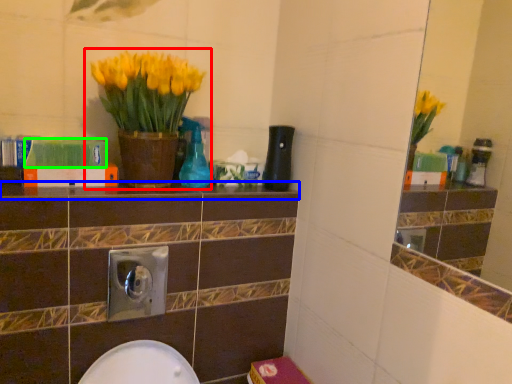
Question: Which object is positioned closest to houseplant (highlighted by a red box)? Select from ledge (highlighted by a blue box) and book (highlighted by a green box).

Choices:
 (A) ledge
 (B) book

Answer: (B)